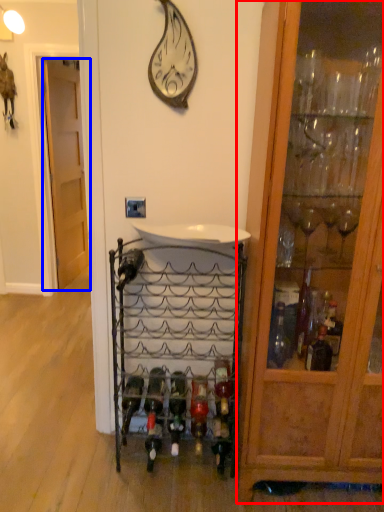
Question: Which object is further to the camera taking this photo, cabinetry (highlighted by a red box) or door (highlighted by a blue box)?

Choices:
 (A) cabinetry
 (B) door

Answer: (B)